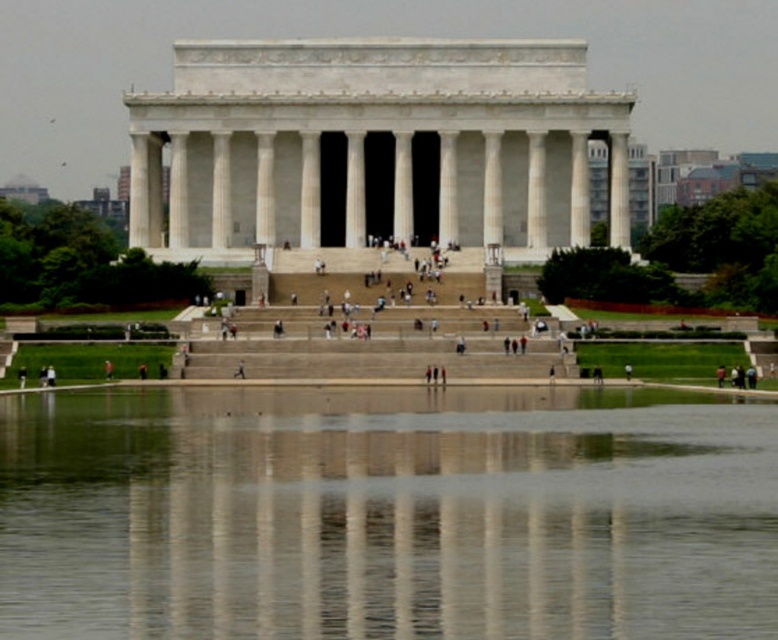
Question: Can you confirm if white marble column at center is wider than white stone stairs at center?

Choices:
 (A) no
 (B) yes

Answer: (B)

Question: Which point is farther to the camera?

Choices:
 (A) white marble column at center
 (B) clear glass water at center

Answer: (A)

Question: Which of the following is the closest to the observer?

Choices:
 (A) (394, 200)
 (B) (517, 513)

Answer: (B)

Question: Which object appears farthest from the camera in this image?

Choices:
 (A) white stone stairs at center
 (B) clear glass water at center

Answer: (A)

Question: Can you confirm if white marble column at center is wider than white stone stairs at center?

Choices:
 (A) yes
 (B) no

Answer: (A)

Question: Can you confirm if clear glass water at center is bigger than white stone stairs at center?

Choices:
 (A) no
 (B) yes

Answer: (B)